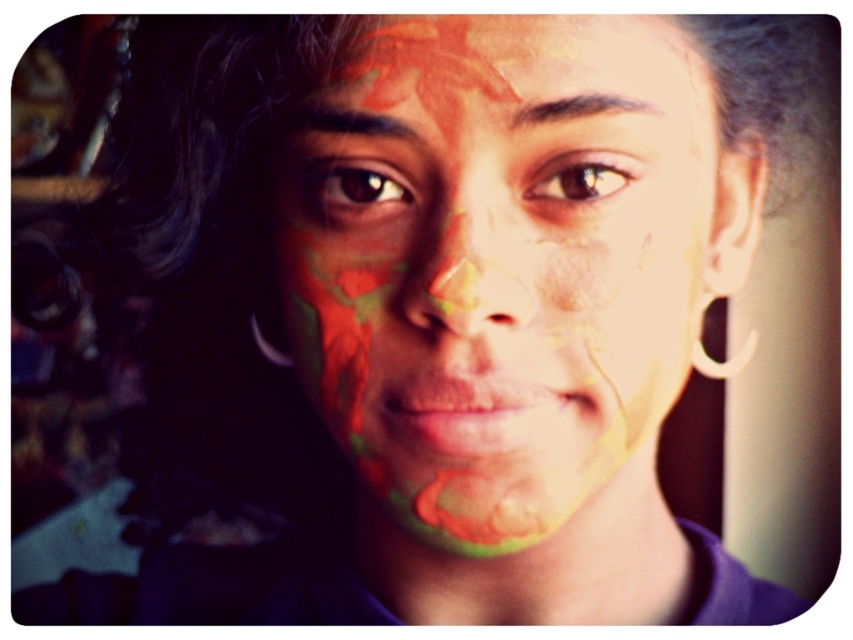
Is multicolored paint at center taller than brown matte eye at upper center?

Yes, multicolored paint at center is taller than brown matte eye at upper center.

Which is more to the left, multicolored paint at center or brown matte eye at upper center?

From the viewer's perspective, multicolored paint at center appears more on the left side.

Between point (703, 205) and point (619, 176), which one is positioned behind?

The point (703, 205) is more distant.

The height and width of the screenshot is (640, 853). In order to click on multicolored paint at center in this screenshot , I will do `click(498, 266)`.

Can you confirm if multicolored paint at center is positioned above brown matte eye at center?

Incorrect, multicolored paint at center is not positioned above brown matte eye at center.

Which is behind, point (352, 323) or point (341, 168)?

Positioned behind is point (352, 323).

This screenshot has width=853, height=640. Identify the location of multicolored paint at center. (x=498, y=266).

Is brown matte eye at center wider than brown matte eye at upper center?

Yes, brown matte eye at center is wider than brown matte eye at upper center.

Which is in front, point (361, 196) or point (608, 193)?

Positioned in front is point (608, 193).

Identify the location of brown matte eye at center. (357, 188).